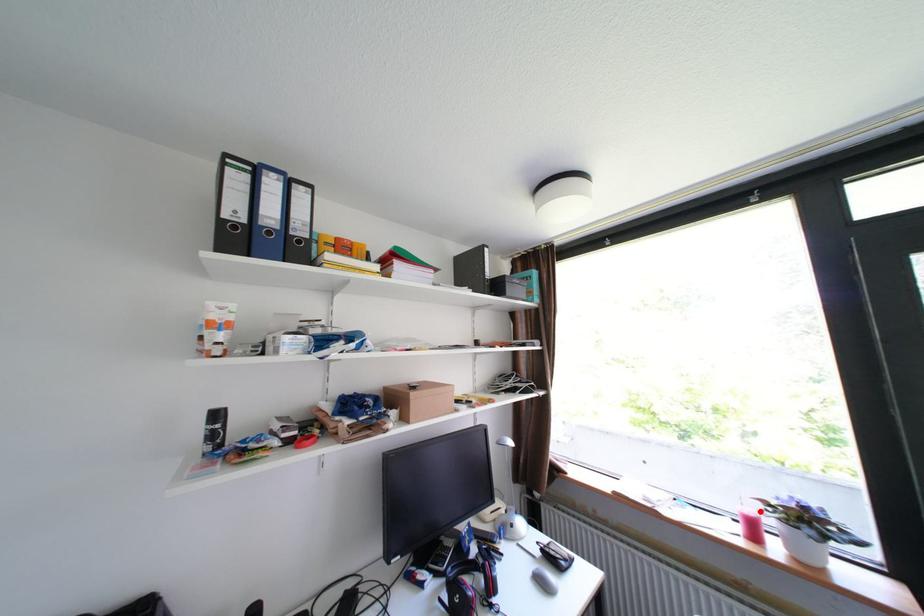
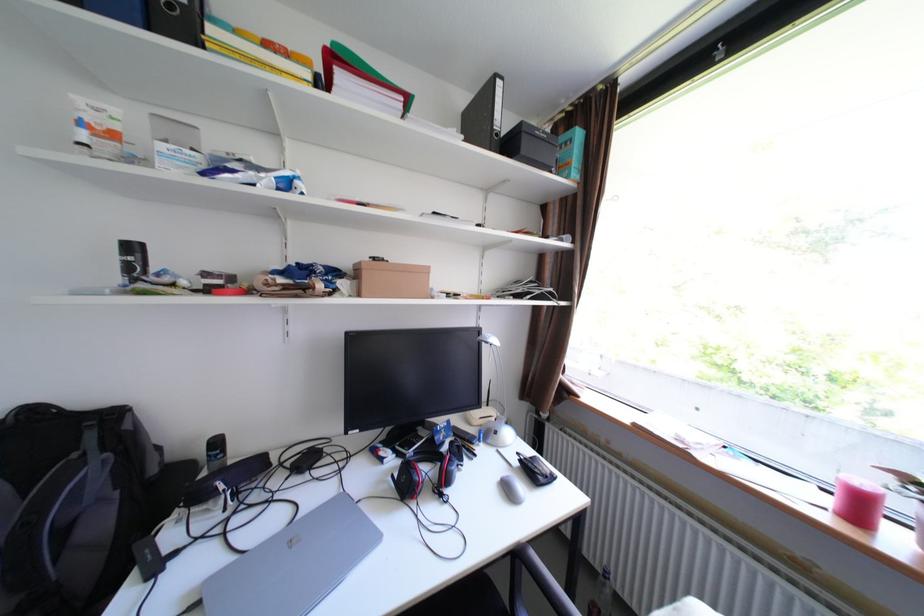
In the second image, find the point that corresponds to the highlighted location in the first image.

(874, 484)